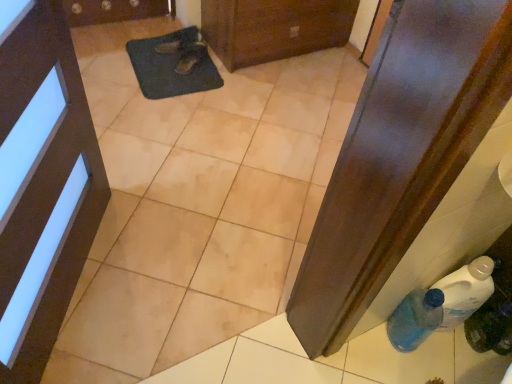
Where is `vacant area that lies to the right of blue translucent bottle at lower right, which ranks as the 1th bottle in left-to-right order`? This screenshot has height=384, width=512. vacant area that lies to the right of blue translucent bottle at lower right, which ranks as the 1th bottle in left-to-right order is located at coordinates (450, 362).